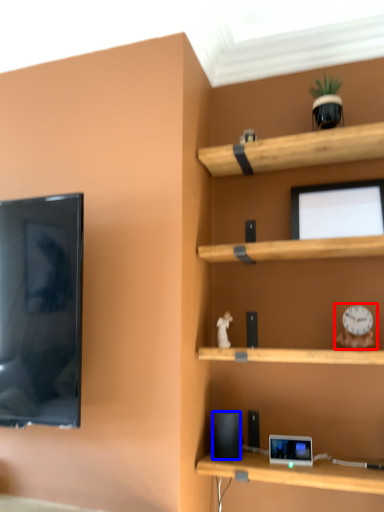
Question: Which of the following is the closest to the observer, toy (highlighted by a red box) or speaker (highlighted by a blue box)?

Choices:
 (A) toy
 (B) speaker

Answer: (A)